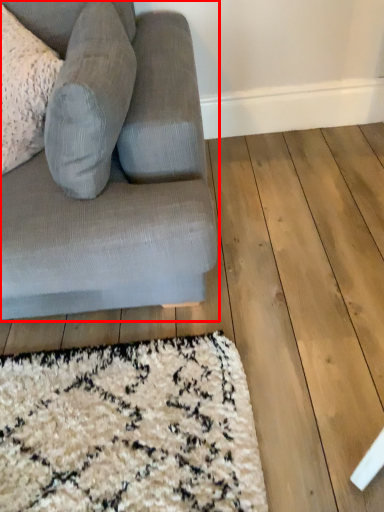
Question: Where is studio couch (annotated by the red box) located in relation to gray in the image?

Choices:
 (A) left
 (B) right

Answer: (B)